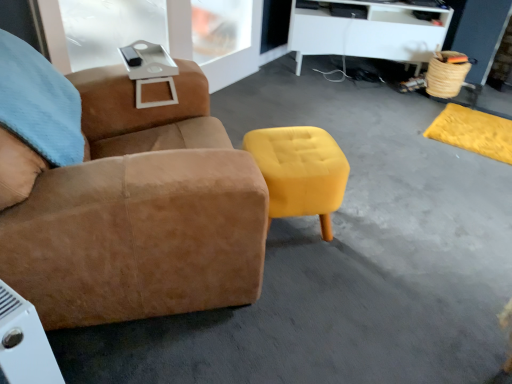
Locate an element on the screen. free space in front of yellow suede ottoman at center is located at coordinates (310, 288).